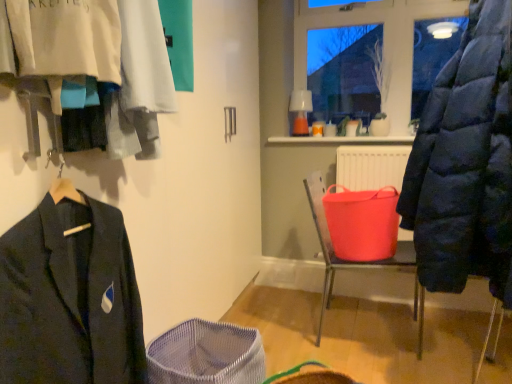
What do you see at coordinates (383, 42) in the screenshot?
I see `transparent glass window at upper center` at bounding box center [383, 42].

Where is `transparent glass window at upper center`? Image resolution: width=512 pixels, height=384 pixels. transparent glass window at upper center is located at coordinates (383, 42).

What do you see at coordinates (466, 163) in the screenshot? I see `matte blue puffer coat at right` at bounding box center [466, 163].

The width and height of the screenshot is (512, 384). Describe the element at coordinates (206, 355) in the screenshot. I see `mesh fabric basket at lower center` at that location.

Identify the location of transparent glass window at upper center. This screenshot has width=512, height=384. (383, 42).

Considering the relative sizes of transparent glass window at upper center and matte black jacket at left in the image provided, is transparent glass window at upper center thinner than matte black jacket at left?

Indeed, transparent glass window at upper center has a lesser width compared to matte black jacket at left.

Considering the positions of points (413, 4) and (81, 220), is point (413, 4) closer to camera compared to point (81, 220)?

No, it is not.

Locate an element on the screen. closet below the transparent glass window at upper center (from the image's perspective) is located at coordinates pos(70,295).

Considering the relative sizes of mesh fabric basket at lower center and transparent glass window at upper center in the image provided, is mesh fabric basket at lower center thinner than transparent glass window at upper center?

Incorrect, the width of mesh fabric basket at lower center is not less than that of transparent glass window at upper center.

Is mesh fabric basket at lower center beside transparent glass window at upper center?

No, mesh fabric basket at lower center is not beside transparent glass window at upper center.

Is mesh fabric basket at lower center positioned with its back to transparent glass window at upper center?

No, mesh fabric basket at lower center is not facing away from transparent glass window at upper center.

Considering the sizes of objects mesh fabric basket at lower center and transparent glass window at upper center in the image provided, who is shorter, mesh fabric basket at lower center or transparent glass window at upper center?

Standing shorter between the two is mesh fabric basket at lower center.

This screenshot has width=512, height=384. Identify the location of suit in front of the rubberized plastic bucket at center. (70, 296).

From the image's perspective, which is below, dark blue woolen suit at left or rubberized plastic bucket at center?

dark blue woolen suit at left appears lower in the image.

Consider the image. Which object is positioned more to the left, dark blue woolen suit at left or rubberized plastic bucket at center?

dark blue woolen suit at left is more to the left.

Who is smaller, mesh fabric basket at lower center or rubberized plastic bucket at center?

mesh fabric basket at lower center.

In the scene shown: Is mesh fabric basket at lower center located outside rubberized plastic bucket at center?

mesh fabric basket at lower center lies outside rubberized plastic bucket at center's area.

Can you confirm if mesh fabric basket at lower center is positioned to the right of rubberized plastic bucket at center?

No, mesh fabric basket at lower center is not to the right of rubberized plastic bucket at center.

Considering the relative sizes of mesh fabric basket at lower center and rubberized plastic bucket at center in the image provided, is mesh fabric basket at lower center taller than rubberized plastic bucket at center?

In fact, mesh fabric basket at lower center may be shorter than rubberized plastic bucket at center.

In terms of width, does dark blue woolen suit at left look wider or thinner when compared to transparent glass window at upper center?

In the image, dark blue woolen suit at left appears to be wider than transparent glass window at upper center.

Is dark blue woolen suit at left positioned behind transparent glass window at upper center?

No, it is not.

Is dark blue woolen suit at left looking in the opposite direction of transparent glass window at upper center?

No, dark blue woolen suit at left is not facing away from transparent glass window at upper center.

Can we say dark blue woolen suit at left lies outside transparent glass window at upper center?

Yes, dark blue woolen suit at left is outside of transparent glass window at upper center.

From a real-world perspective, which is physically above, rubberized plastic bucket at center or transparent glass window at upper center?

In real-world perspective, transparent glass window at upper center is above.

From the image's perspective, is rubberized plastic bucket at center located above or below transparent glass window at upper center?

rubberized plastic bucket at center is below transparent glass window at upper center.

Based on the photo, which is closer, [318,174] or [415,10]?

The point [415,10] is closer to the camera.

Considering the relative sizes of rubberized plastic bucket at center and transparent glass window at upper center in the image provided, is rubberized plastic bucket at center thinner than transparent glass window at upper center?

In fact, rubberized plastic bucket at center might be wider than transparent glass window at upper center.

Where is `suit on the left side of rubberized plastic bucket at center`? The image size is (512, 384). suit on the left side of rubberized plastic bucket at center is located at coordinates 70,296.

Which is correct: rubberized plastic bucket at center is inside dark blue woolen suit at left, or outside of it?

rubberized plastic bucket at center cannot be found inside dark blue woolen suit at left.

Between rubberized plastic bucket at center and dark blue woolen suit at left, which one has larger width?

Wider between the two is rubberized plastic bucket at center.

Considering the positions of point (392, 257) and point (95, 204), is point (392, 257) closer or farther from the camera than point (95, 204)?

Point (392, 257) appears to be farther away from the viewer than point (95, 204).

Find the location of a particular element. closet lying below the transparent glass window at upper center (from the image's perspective) is located at coordinates (70, 295).

You are a GUI agent. You are given a task and a screenshot of the screen. Output one action in this format:
    pyautogui.click(x=<x>, y=<y>)
    Task: Click on the window above the mesh fabric basket at lower center (from the image's perspective)
    This screenshot has width=512, height=384.
    Given the screenshot: What is the action you would take?
    pyautogui.click(x=383, y=42)

Considering their positions, is mesh fabric basket at lower center positioned closer to rubberized plastic bucket at center than matte blue puffer coat at right?

Among the two, matte blue puffer coat at right is located nearer to rubberized plastic bucket at center.

Estimate the real-world distances between objects in this image. Which object is further from mesh fabric basket at lower center, rubberized plastic bucket at center or matte blue puffer coat at right?

Based on the image, matte blue puffer coat at right appears to be further to mesh fabric basket at lower center.

Which object lies further to the anchor point rubberized plastic bucket at center, matte black jacket at left or dark blue woolen suit at left?

The object further to rubberized plastic bucket at center is dark blue woolen suit at left.

When comparing their distances from transparent glass window at upper center, does dark blue woolen suit at left or rubberized plastic bucket at center seem closer?

rubberized plastic bucket at center is closer to transparent glass window at upper center.

Looking at the image, which one is located further to matte blue puffer coat at right, rubberized plastic bucket at center or dark blue woolen suit at left?

dark blue woolen suit at left is further to matte blue puffer coat at right.

From the image, which object appears to be nearer to mesh fabric basket at lower center, matte black jacket at left or matte blue puffer coat at right?

matte black jacket at left lies closer to mesh fabric basket at lower center than the other object.

Considering their positions, is mesh fabric basket at lower center positioned closer to matte blue puffer coat at right than transparent glass window at upper center?

The object closer to matte blue puffer coat at right is mesh fabric basket at lower center.

Estimate the real-world distances between objects in this image. Which object is further from transparent glass window at upper center, dark blue woolen suit at left or matte blue puffer coat at right?

Among the two, dark blue woolen suit at left is located further to transparent glass window at upper center.

Find the location of a particular element. The width and height of the screenshot is (512, 384). basket container between matte blue puffer coat at right and transparent glass window at upper center from front to back is located at coordinates (206, 355).

Where is `coat between matte black jacket at left and transparent glass window at upper center from front to back`? The width and height of the screenshot is (512, 384). coat between matte black jacket at left and transparent glass window at upper center from front to back is located at coordinates (466, 163).

This screenshot has height=384, width=512. I want to click on suit located between matte black jacket at left and transparent glass window at upper center in the depth direction, so (70, 296).

The width and height of the screenshot is (512, 384). I want to click on basket container between matte black jacket at left and rubberized plastic bucket at center along the z-axis, so click(x=206, y=355).